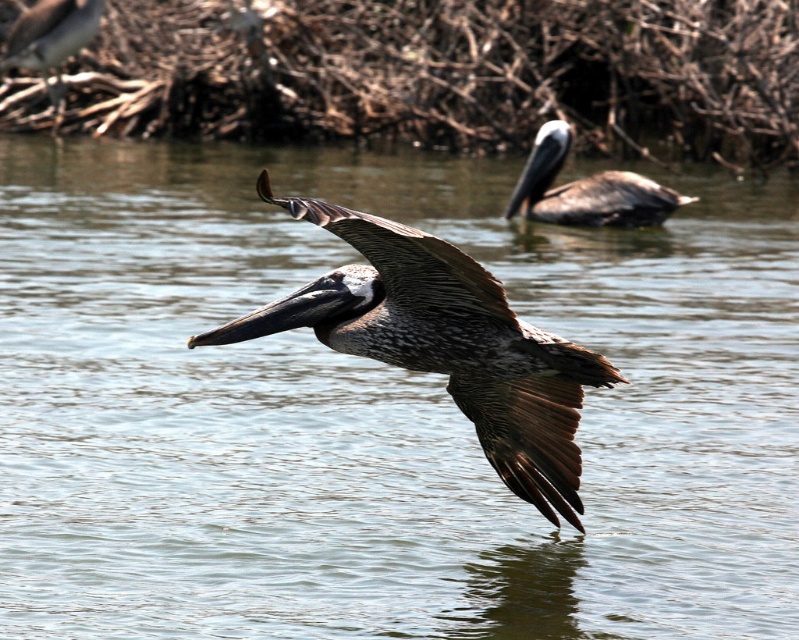
Question: Is brown feathered pelican at center further to the viewer compared to brown feathered pelican at upper right?

Choices:
 (A) no
 (B) yes

Answer: (A)

Question: Does brown feathered pelican at center have a lesser width compared to brown feathered pelican at upper right?

Choices:
 (A) yes
 (B) no

Answer: (A)

Question: Which of the following is the closest to the observer?

Choices:
 (A) (340, 284)
 (B) (633, 218)

Answer: (A)

Question: Is brown feathered pelican at center behind brown feathered pelican at upper right?

Choices:
 (A) no
 (B) yes

Answer: (A)

Question: Which point is farther to the camera?

Choices:
 (A) (447, 269)
 (B) (549, 138)

Answer: (B)